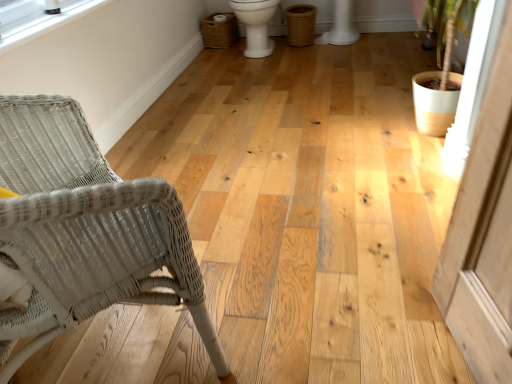
Question: Is point (200, 26) positioned closer to the camera than point (74, 178)?

Choices:
 (A) closer
 (B) farther

Answer: (B)

Question: Considering their positions, is woven brown laundry basket at upper center located in front of or behind white wicker chair at left?

Choices:
 (A) behind
 (B) front

Answer: (A)

Question: Estimate the real-world distances between objects in this image. Which object is farther from the white glossy toilet bowl at center?

Choices:
 (A) white wicker chair at left
 (B) clear plastic window screen at upper left
 (C) woven brown laundry basket at upper center

Answer: (A)

Question: Which object is positioned closest to the white glossy toilet bowl at center?

Choices:
 (A) clear plastic window screen at upper left
 (B) white wicker chair at left
 (C) woven brown laundry basket at upper center

Answer: (C)